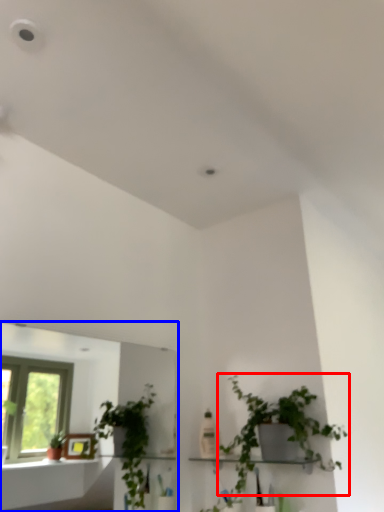
Question: Which object is further to the camera taking this photo, houseplant (highlighted by a red box) or mirror (highlighted by a blue box)?

Choices:
 (A) houseplant
 (B) mirror

Answer: (A)